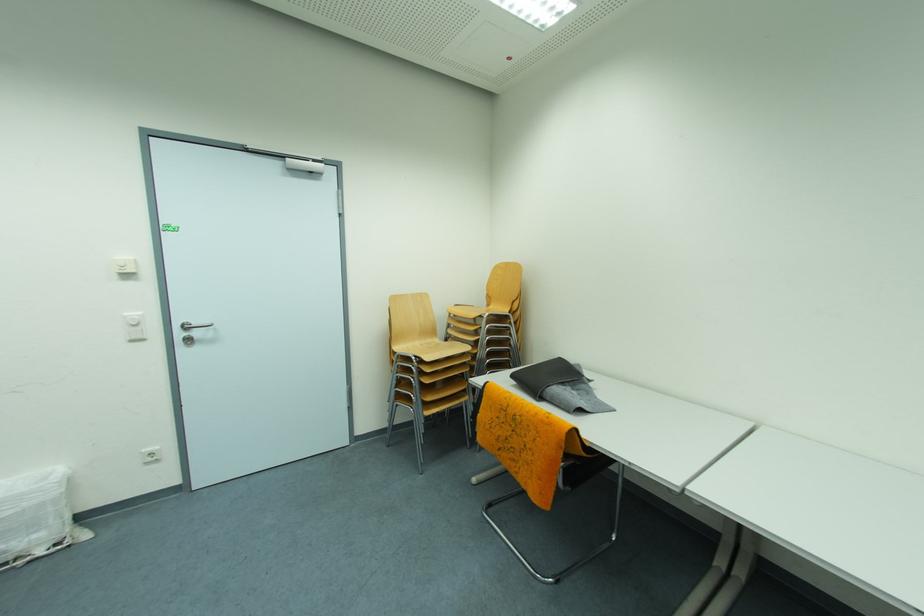
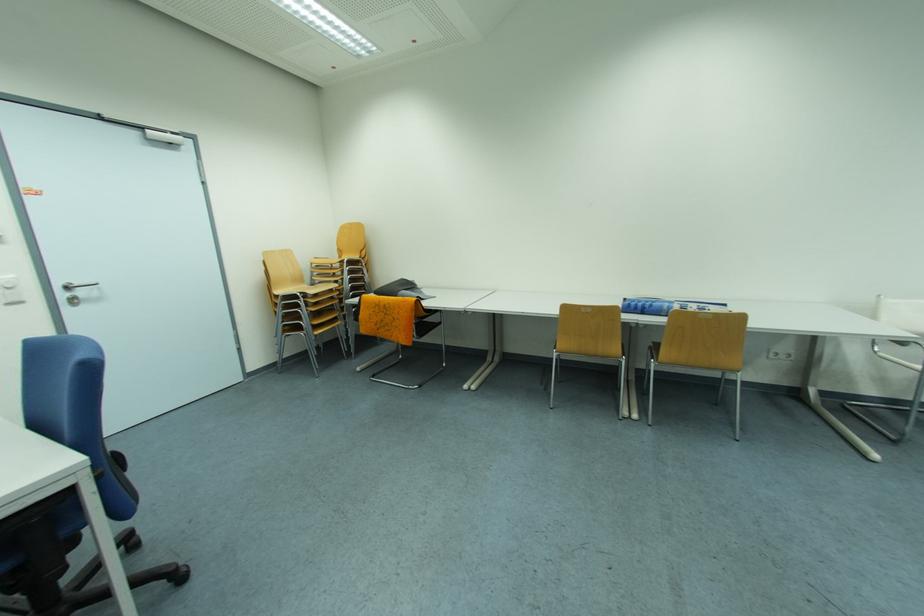
The point at (x=488, y=416) is marked in the first image. Where is the corresponding point in the second image?

(369, 318)